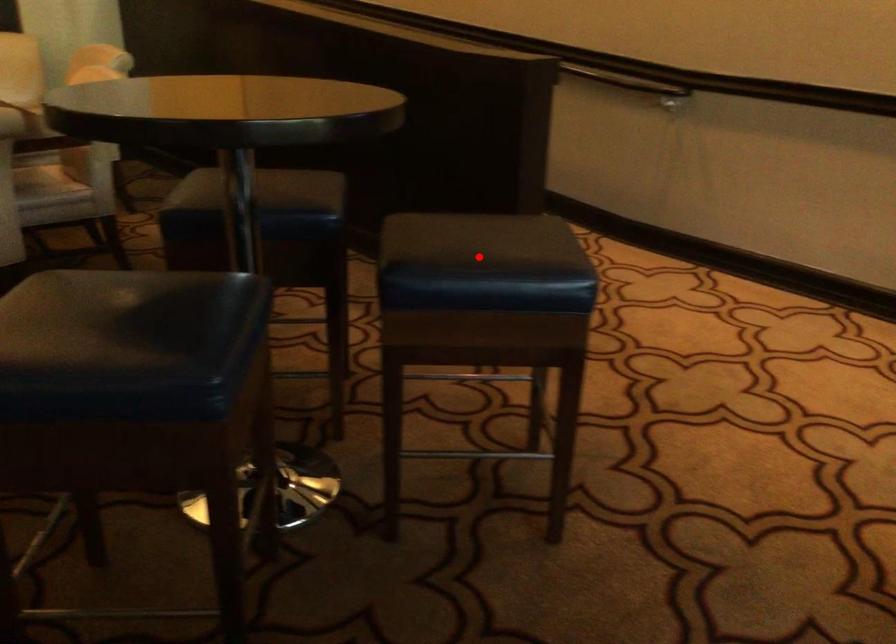
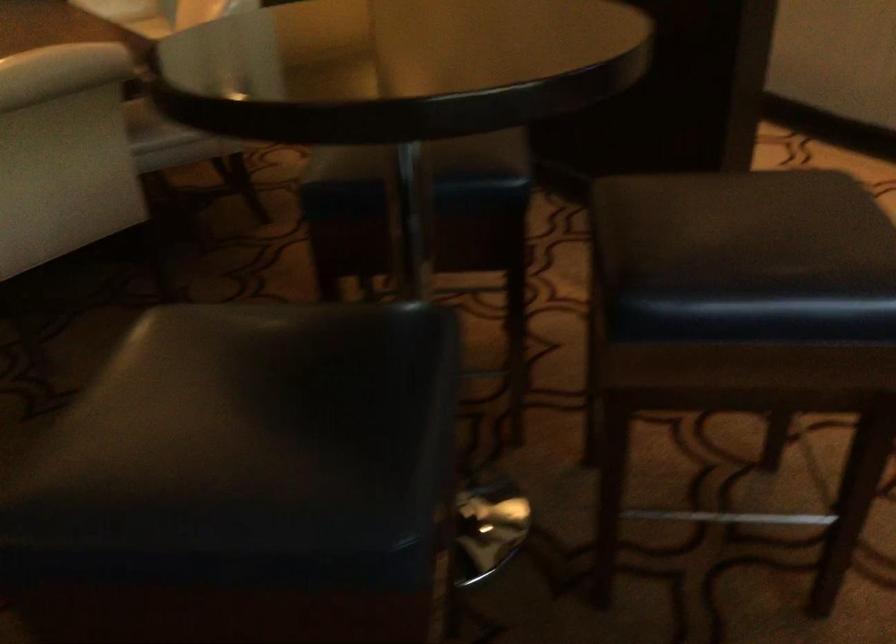
Find the pixel in the second image that matches the highlighted location in the first image.

(745, 257)